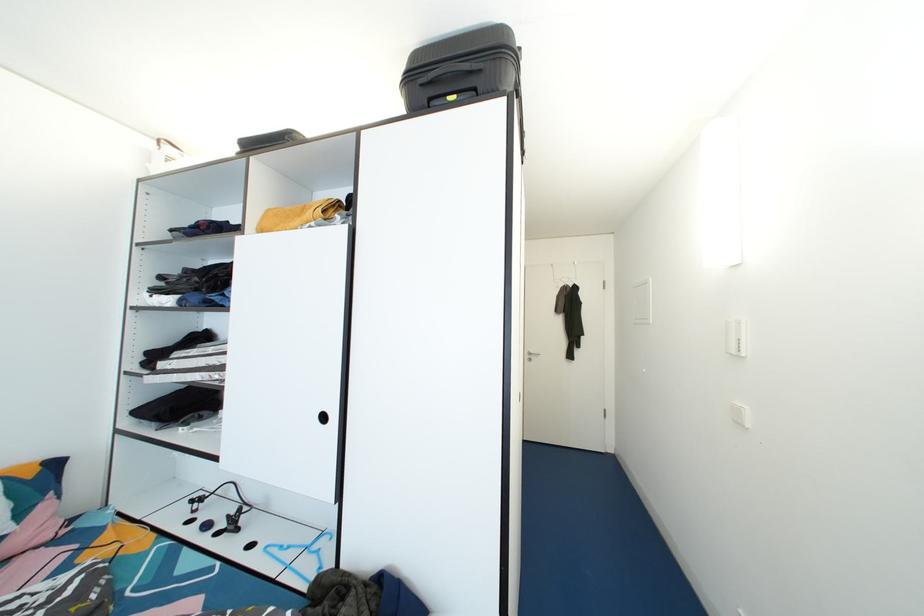
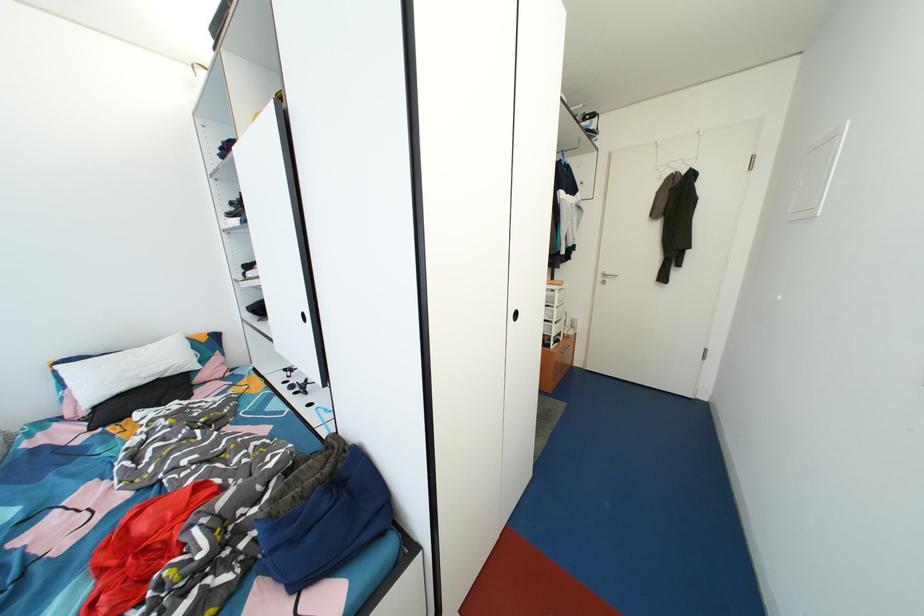
What movement of the cameraman would produce the second image?

The movement direction of the cameraman is right, forward.